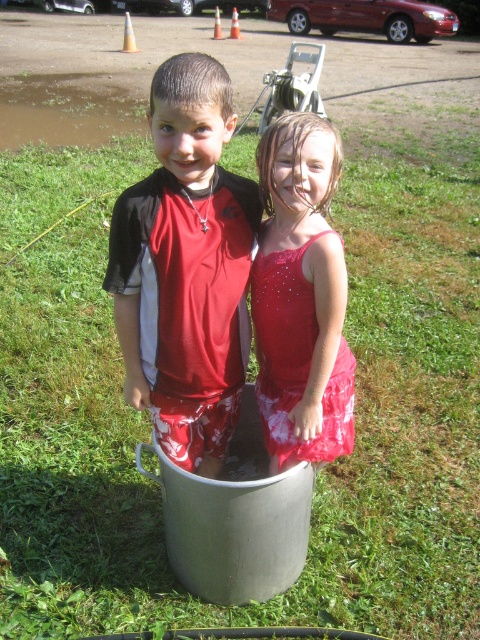
What are the coordinates of the matte red shirt at center?

The matte red shirt at center is located at coordinates point [186,268].

You are a photographer trying to capture the children in the bucket. You need to know which clothing item is higher in the frame to ensure proper focus. Which is higher between the matte red shirt at center and the sparkly red dress at center?

The matte red shirt at center is located above the sparkly red dress at center, so it is higher in the frame.

You are a photographer trying to capture both the matte red shirt at center and the sparkly red dress at center in a single shot. Which one will appear larger in the photo?

The matte red shirt at center will appear larger in the photo because it is closer to the viewer than the sparkly red dress at center.